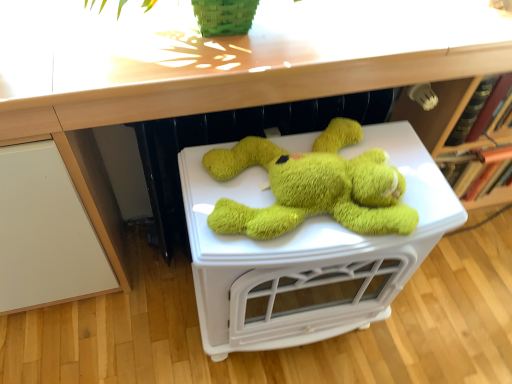
You are a GUI agent. You are given a task and a screenshot of the screen. Output one action in this format:
    pyautogui.click(x=<x>, y=<y>)
    Task: Click on the empty space that is ontop of soft green plush toy at center (from a real-world perspective)
    This screenshot has height=384, width=512.
    Given the screenshot: What is the action you would take?
    pyautogui.click(x=291, y=197)